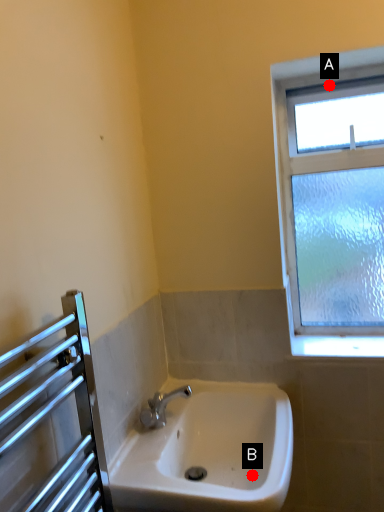
Question: Two points are circled on the image, labeled by A and B beside each circle. Which point is closer to the camera?

Choices:
 (A) A is closer
 (B) B is closer

Answer: (B)